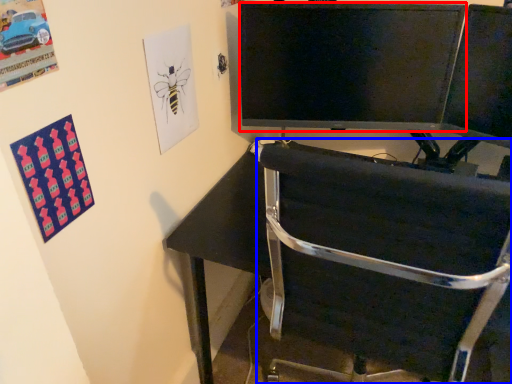
Question: Which object appears closest to the camera in this image, television (highlighted by a red box) or chair (highlighted by a blue box)?

Choices:
 (A) television
 (B) chair

Answer: (B)